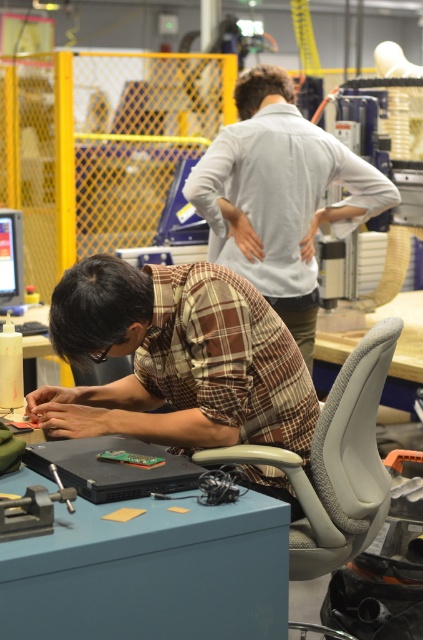
Question: Does brown plaid shirt at lower left appear under white smooth shirt at upper center?

Choices:
 (A) no
 (B) yes

Answer: (B)

Question: Can you confirm if brown plaid shirt at lower left is thinner than gray fabric swivel chair at right?

Choices:
 (A) no
 (B) yes

Answer: (A)

Question: Is white smooth shirt at upper center bigger than gray fabric swivel chair at right?

Choices:
 (A) yes
 (B) no

Answer: (A)

Question: Which point is closer to the camera taking this photo?

Choices:
 (A) (271, 324)
 (B) (307, 145)

Answer: (A)

Question: Based on their relative distances, which object is farther from the gray fabric swivel chair at right?

Choices:
 (A) brown plaid shirt at lower left
 (B) white smooth shirt at upper center

Answer: (B)

Question: Which of the following is the farthest from the observer?

Choices:
 (A) (367, 404)
 (B) (183, 448)
 (C) (315, 269)

Answer: (C)